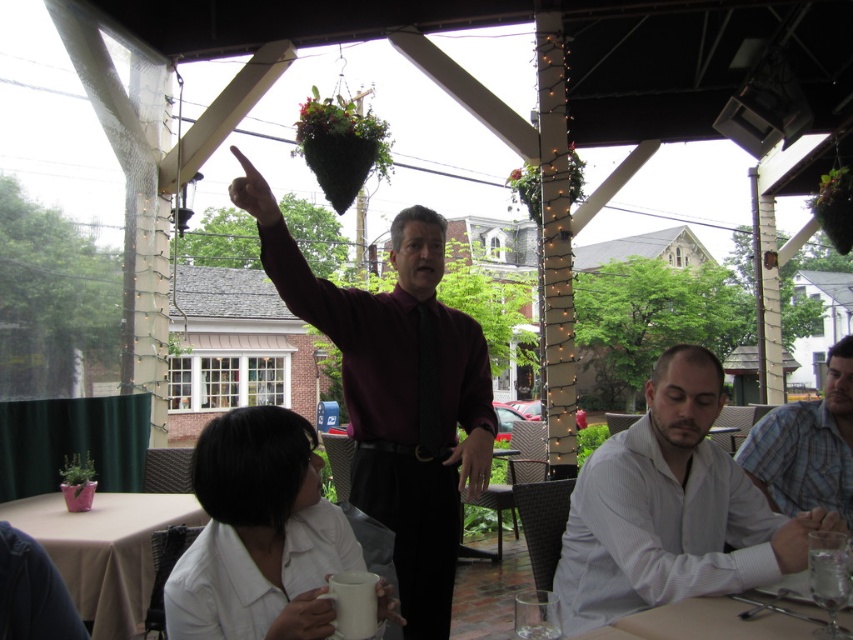
Question: Which of the following is the closest to the observer?

Choices:
 (A) beige fabric table at lower left
 (B) matte burgundy shirt at center
 (C) plaid shirt at right
 (D) white textured shirt at lower right

Answer: (D)

Question: Can you confirm if white textured shirt at lower right is smaller than beige fabric table at lower left?

Choices:
 (A) yes
 (B) no

Answer: (B)

Question: Which is farther from the matte burgundy shirt at center?

Choices:
 (A) white textured shirt at lower right
 (B) plaid shirt at right
 (C) beige fabric table at lower left

Answer: (C)

Question: Considering the real-world distances, which object is farthest from the beige fabric table at lower left?

Choices:
 (A) white textured shirt at lower right
 (B) plaid shirt at right

Answer: (B)

Question: Is white textured shirt at lower right thinner than beige fabric table at lower left?

Choices:
 (A) no
 (B) yes

Answer: (B)

Question: Does white textured shirt at lower right appear on the right side of plaid shirt at right?

Choices:
 (A) yes
 (B) no

Answer: (B)